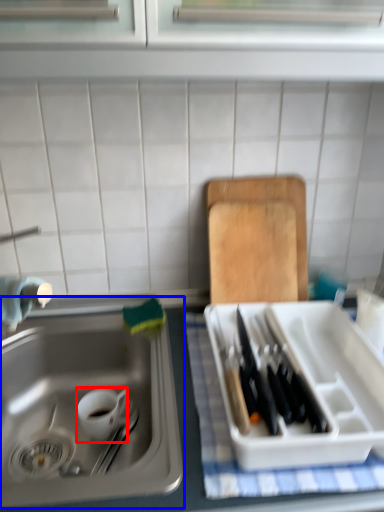
Question: Which object is further to the camera taking this photo, tableware (highlighted by a red box) or sink (highlighted by a blue box)?

Choices:
 (A) tableware
 (B) sink

Answer: (A)